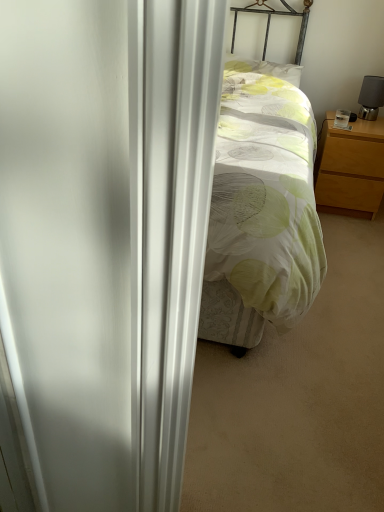
What do you see at coordinates (350, 166) in the screenshot? I see `light wood/finish nightstand at right` at bounding box center [350, 166].

Locate an element on the screen. This screenshot has height=512, width=384. black matte table lamp at right is located at coordinates (371, 97).

What are the coordinates of `light wood/finish nightstand at right` in the screenshot? It's located at (350, 166).

Considering the relative sizes of light green fabric pillow at center and light wood/finish nightstand at right in the image provided, is light green fabric pillow at center taller than light wood/finish nightstand at right?

No.

From the picture: Between light green fabric pillow at center and light wood/finish nightstand at right, which one has smaller width?

With smaller width is light green fabric pillow at center.

From a real-world perspective, does light green fabric pillow at center sit lower than light wood/finish nightstand at right?

Incorrect, from a real-world perspective, light green fabric pillow at center is higher than light wood/finish nightstand at right.

Considering the positions of point (234, 66) and point (360, 197), is point (234, 66) closer or farther from the camera than point (360, 197)?

Point (234, 66).

Which of these two, light green fabric pillow at center or black matte table lamp at right, stands taller?

With more height is black matte table lamp at right.

Based on the photo, is light green fabric pillow at center inside the boundaries of black matte table lamp at right, or outside?

light green fabric pillow at center lies outside black matte table lamp at right.

From the picture: Can you tell me how much light green fabric pillow at center and black matte table lamp at right differ in facing direction?

light green fabric pillow at center and black matte table lamp at right are facing 1.69 degrees away from each other.

Which of these two, light green fabric pillow at center or black matte table lamp at right, is smaller?

Smaller between the two is black matte table lamp at right.

From the picture: Is black matte table lamp at right wider or thinner than light wood/finish nightstand at right?

In the image, black matte table lamp at right appears to be more narrow than light wood/finish nightstand at right.

Is the depth of black matte table lamp at right greater than that of light wood/finish nightstand at right?

Yes, it is behind light wood/finish nightstand at right.

Between black matte table lamp at right and light wood/finish nightstand at right, which one has more height?

light wood/finish nightstand at right.

Between black matte table lamp at right and light wood/finish nightstand at right, which one appears on the left side from the viewer's perspective?

light wood/finish nightstand at right.

Is light wood/finish nightstand at right turned away from light green fabric pillow at center?

No, light wood/finish nightstand at right's orientation is not away from light green fabric pillow at center.

Would you consider light wood/finish nightstand at right to be distant from light green fabric pillow at center?

They are positioned close to each other.

Considering the positions of points (344, 172) and (248, 67), is point (344, 172) closer to camera compared to point (248, 67)?

Yes, point (344, 172) is closer to viewer.

Between black matte table lamp at right and light green fabric pillow at center, which one has smaller size?

With smaller size is black matte table lamp at right.

Does black matte table lamp at right have a lesser width compared to light green fabric pillow at center?

Yes, black matte table lamp at right is thinner than light green fabric pillow at center.

From the image's perspective, is black matte table lamp at right under light green fabric pillow at center?

Yes.

Between point (360, 113) and point (257, 69), which one is positioned in front?

Point (257, 69)

Is light wood/finish nightstand at right touching black matte table lamp at right?

light wood/finish nightstand at right and black matte table lamp at right are clearly separated.

How far apart are light wood/finish nightstand at right and black matte table lamp at right?

light wood/finish nightstand at right is 16.05 inches from black matte table lamp at right.

In the image, is light wood/finish nightstand at right positioned in front of or behind black matte table lamp at right?

Visually, light wood/finish nightstand at right is located in front of black matte table lamp at right.

Which of these two, light wood/finish nightstand at right or black matte table lamp at right, is thinner?

Thinner between the two is black matte table lamp at right.

This screenshot has height=512, width=384. In order to click on pillow on the left of the light wood/finish nightstand at right in this screenshot , I will do `click(265, 68)`.

I want to click on table lamp on the right side of light green fabric pillow at center, so click(371, 97).

From the image, which object appears to be nearer to light green fabric pillow at center, light wood/finish nightstand at right or black matte table lamp at right?

black matte table lamp at right is closer to light green fabric pillow at center.

Which object lies further to the anchor point light green fabric pillow at center, black matte table lamp at right or light wood/finish nightstand at right?

light wood/finish nightstand at right is further to light green fabric pillow at center.

From the image, which object appears to be farther from black matte table lamp at right, light green fabric pillow at center or light wood/finish nightstand at right?

light green fabric pillow at center lies further to black matte table lamp at right than the other object.

Estimate the real-world distances between objects in this image. Which object is closer to light wood/finish nightstand at right, black matte table lamp at right or light green fabric pillow at center?

black matte table lamp at right.

Which object lies further to the anchor point light wood/finish nightstand at right, light green fabric pillow at center or black matte table lamp at right?

light green fabric pillow at center lies further to light wood/finish nightstand at right than the other object.

Estimate the real-world distances between objects in this image. Which object is further from black matte table lamp at right, light wood/finish nightstand at right or light green fabric pillow at center?

Among the two, light green fabric pillow at center is located further to black matte table lamp at right.

This screenshot has width=384, height=512. I want to click on nightstand between light green fabric pillow at center and black matte table lamp at right from left to right, so click(x=350, y=166).